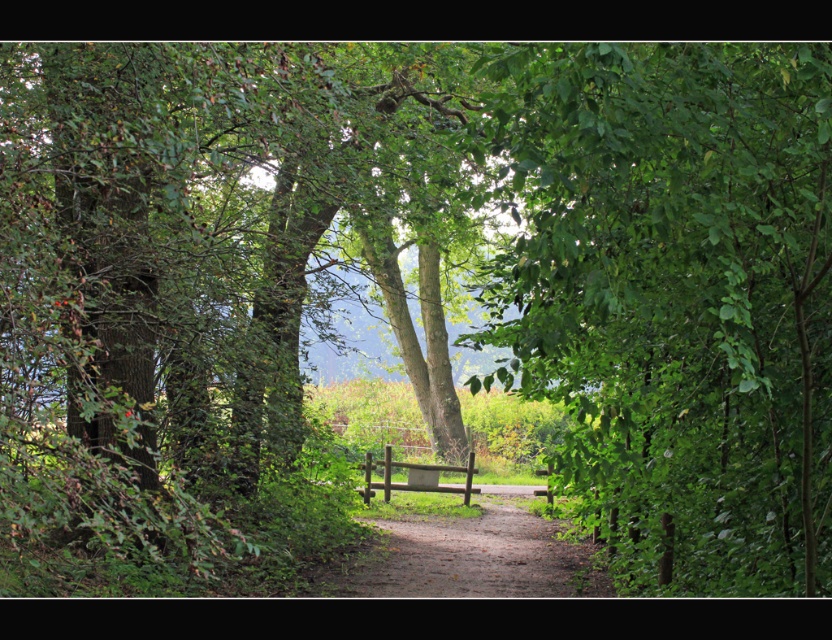
Question: Which object appears farthest from the camera in this image?

Choices:
 (A) dirt/gravel path at center
 (B) wooden bench at center
 (C) green leafy tree at center

Answer: (B)

Question: Is green leafy tree at center to the right of wooden bench at center from the viewer's perspective?

Choices:
 (A) no
 (B) yes

Answer: (B)

Question: Does green leafy tree at center appear over dirt/gravel path at center?

Choices:
 (A) yes
 (B) no

Answer: (A)

Question: Which of the following is the closest to the observer?

Choices:
 (A) (535, 532)
 (B) (436, 483)

Answer: (A)

Question: Is green leafy tree at center positioned at the back of wooden bench at center?

Choices:
 (A) no
 (B) yes

Answer: (A)

Question: Which point is closer to the camera taking this photo?

Choices:
 (A) (436, 468)
 (B) (632, 413)
 (C) (578, 570)

Answer: (B)